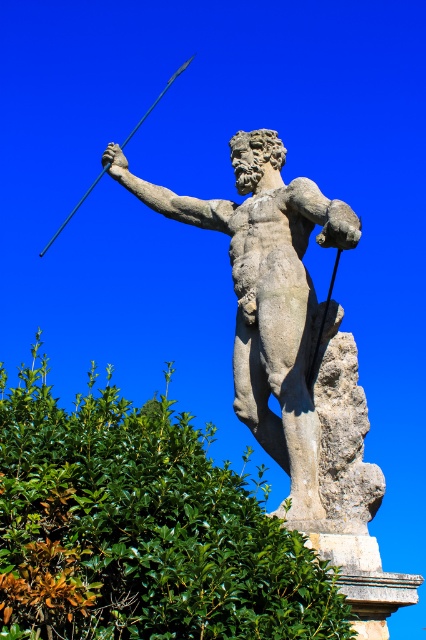
You are an art conservator assessing the statue and spear in the image. You need to determine if the stone statue at center can be placed on a pedestal that is narrower than the smooth metal spear at upper left. Can it fit?

The stone statue at center might be wider than the smooth metal spear at upper left, so if the pedestal is narrower than the spear, the statue may not fit properly. Further measurements are needed to confirm.

You are a bird flying towards the green leafy hedge at upper center and the stone statue at center. Which object will you encounter first?

The green leafy hedge at upper center is below the stone statue at center, so you will encounter the stone statue at center first.